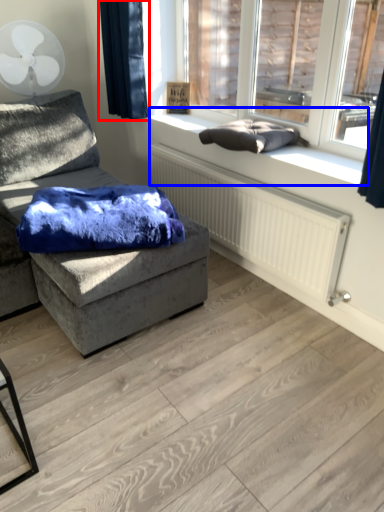
Question: Among these objects, which one is nearest to the camera, curtain (highlighted by a red box) or window sill (highlighted by a blue box)?

Choices:
 (A) curtain
 (B) window sill

Answer: (B)